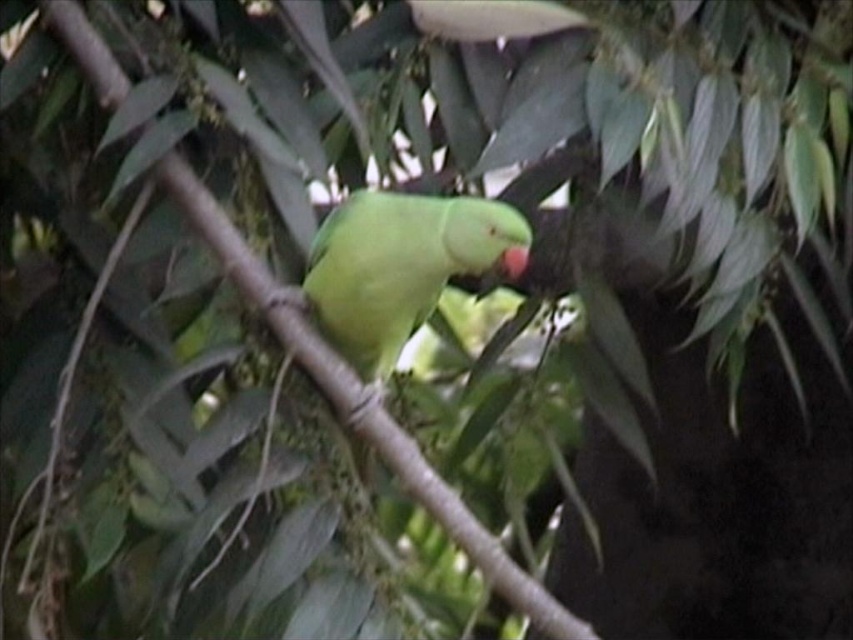
Question: Is green matte parrot at center bigger than green matte beak at center?

Choices:
 (A) yes
 (B) no

Answer: (A)

Question: Which object is farther from the camera taking this photo?

Choices:
 (A) green matte parrot at center
 (B) green matte beak at center

Answer: (A)

Question: Is green matte parrot at center to the left of green matte beak at center from the viewer's perspective?

Choices:
 (A) yes
 (B) no

Answer: (A)

Question: Observing the image, what is the correct spatial positioning of green matte parrot at center in reference to green matte beak at center?

Choices:
 (A) below
 (B) above

Answer: (A)

Question: Among these objects, which one is farthest from the camera?

Choices:
 (A) green matte parrot at center
 (B) green matte beak at center

Answer: (A)